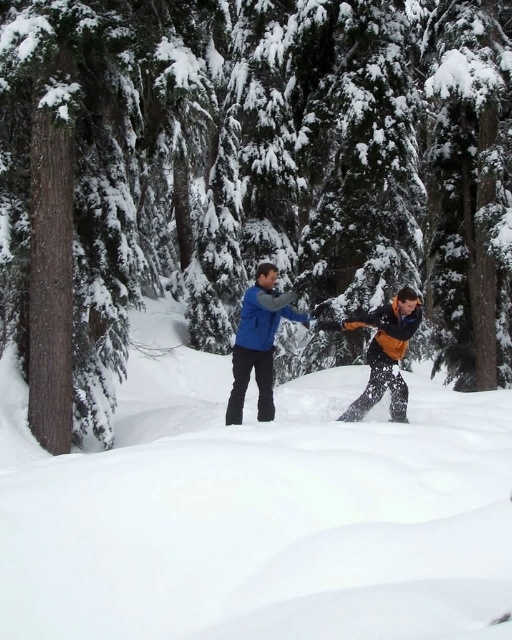
Question: Is white fluffy snow at center to the left of blue matte jacket at center from the viewer's perspective?

Choices:
 (A) no
 (B) yes

Answer: (B)

Question: Is blue fabric jacket at center positioned behind blue matte jacket at center?

Choices:
 (A) yes
 (B) no

Answer: (A)

Question: Which of the following is the farthest from the observer?

Choices:
 (A) brown textured trunk at center
 (B) blue matte jacket at center

Answer: (B)

Question: Can you confirm if white fluffy snow at center is positioned above orange fleece jacket at center?

Choices:
 (A) yes
 (B) no

Answer: (B)

Question: Which point is closer to the camera?

Choices:
 (A) blue matte jacket at center
 (B) white fluffy snow at center

Answer: (B)

Question: Among these points, which one is farthest from the camera?

Choices:
 (A) (426, 456)
 (B) (403, 301)

Answer: (B)